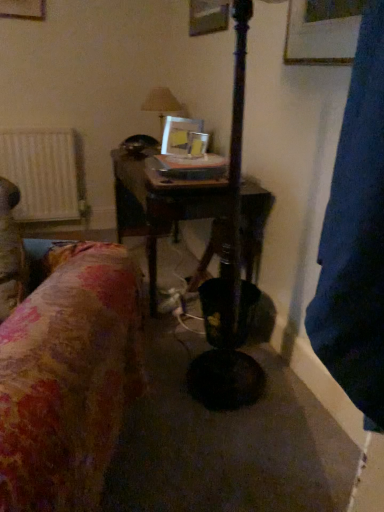
Question: Is wooden table at center next to metallic silver picture frame at center and touching it?

Choices:
 (A) no
 (B) yes

Answer: (A)

Question: Is wooden table at center not inside metallic silver picture frame at center?

Choices:
 (A) yes
 (B) no

Answer: (A)

Question: Considering the relative sizes of wooden table at center and metallic silver picture frame at center in the image provided, is wooden table at center bigger than metallic silver picture frame at center?

Choices:
 (A) no
 (B) yes

Answer: (B)

Question: Is wooden table at center turned away from metallic silver picture frame at center?

Choices:
 (A) no
 (B) yes

Answer: (A)

Question: From a real-world perspective, is wooden table at center below metallic silver picture frame at center?

Choices:
 (A) no
 (B) yes

Answer: (B)

Question: Is point (246, 276) closer or farther from the camera than point (200, 128)?

Choices:
 (A) closer
 (B) farther

Answer: (A)

Question: From the image's perspective, is wooden table at center located above or below metallic silver picture frame at center?

Choices:
 (A) above
 (B) below

Answer: (B)

Question: From a real-world perspective, relative to metallic silver picture frame at center, is wooden table at center vertically above or below?

Choices:
 (A) above
 (B) below

Answer: (B)

Question: Is wooden table at center bigger or smaller than metallic silver picture frame at center?

Choices:
 (A) small
 (B) big

Answer: (B)

Question: Does point (167, 132) appear closer or farther from the camera than point (34, 204)?

Choices:
 (A) farther
 (B) closer

Answer: (B)

Question: Choose the correct answer: Is metallic silver picture frame at center inside white textured radiator at left or outside it?

Choices:
 (A) outside
 (B) inside

Answer: (A)

Question: Relative to white textured radiator at left, is metallic silver picture frame at center in front or behind?

Choices:
 (A) behind
 (B) front

Answer: (B)

Question: Would you say metallic silver picture frame at center is to the left or to the right of white textured radiator at left in the picture?

Choices:
 (A) left
 (B) right

Answer: (B)

Question: From the image's perspective, is metallic silver picture frame at center located above or below matte white lampshade at center?

Choices:
 (A) above
 (B) below

Answer: (B)

Question: Considering the positions of metallic silver picture frame at center and matte white lampshade at center in the image, is metallic silver picture frame at center bigger or smaller than matte white lampshade at center?

Choices:
 (A) small
 (B) big

Answer: (A)